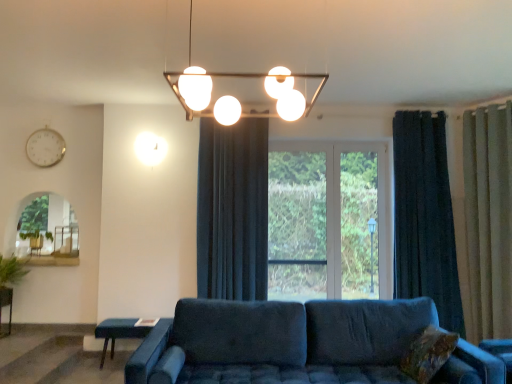
At what (x,y) coordinates should I click in order to perform the action: click on metallic pendant light at upper center. Please return your answer as a coordinate pair (x, y). Image resolution: width=512 pixels, height=384 pixels. Looking at the image, I should click on (234, 97).

At what (x,y) coordinates should I click in order to perform the action: click on beige fabric curtain at right, arranged as the 1th curtain when viewed from the right. Please return your answer as a coordinate pair (x, y). Looking at the image, I should click on (489, 218).

Where is `green leafy plant at left`? This screenshot has width=512, height=384. green leafy plant at left is located at coordinates (11, 271).

I want to click on white metallic clock at upper left, so click(x=45, y=147).

Identify the location of metallic pendant light at upper center. (234, 97).

Is brown textured pillow at lower right next to white metallic clock at upper left?

No, brown textured pillow at lower right is not next to white metallic clock at upper left.

What's the angular difference between brown textured pillow at lower right and white metallic clock at upper left's facing directions?

88.8 degrees.

Does brown textured pillow at lower right contain white metallic clock at upper left?

No, white metallic clock at upper left is not inside brown textured pillow at lower right.

From the picture: Measure the distance from brown textured pillow at lower right to white metallic clock at upper left.

brown textured pillow at lower right and white metallic clock at upper left are 4.40 meters apart from each other.

Is brown textured pillow at lower right inside green leafy plant at left?

Definitely not — brown textured pillow at lower right is not inside green leafy plant at left.

Is green leafy plant at left placed right next to brown textured pillow at lower right?

green leafy plant at left is not next to brown textured pillow at lower right, and they're not touching.

From a real-world perspective, relative to brown textured pillow at lower right, is green leafy plant at left vertically above or below?

In terms of real-world spatial position, green leafy plant at left is above brown textured pillow at lower right.

Considering the relative sizes of green leafy plant at left and brown textured pillow at lower right in the image provided, is green leafy plant at left wider than brown textured pillow at lower right?

Yes, green leafy plant at left is wider than brown textured pillow at lower right.

Can you tell me how much white metallic clock at upper left and wooden table at left, the 1th table in the left-to-right sequence, differ in facing direction?

The facing directions of white metallic clock at upper left and wooden table at left, the 1th table in the left-to-right sequence, are 2.54 degrees apart.

Is white metallic clock at upper left oriented towards wooden table at left, the 1th table in the left-to-right sequence?

No, white metallic clock at upper left is not facing towards wooden table at left, the 1th table in the left-to-right sequence.

Between white metallic clock at upper left and wooden table at left, the 1th table in the left-to-right sequence, which one has more height?

white metallic clock at upper left.

Is beige fabric curtain at right, the third curtain when ordered from left to right, looking in the opposite direction of brown textured pillow at lower right?

No, beige fabric curtain at right, the third curtain when ordered from left to right, is not facing the opposite direction of brown textured pillow at lower right.

Is the depth of beige fabric curtain at right, arranged as the 1th curtain when viewed from the right, greater than that of brown textured pillow at lower right?

Yes, beige fabric curtain at right, arranged as the 1th curtain when viewed from the right, is further from the camera.

How many degrees apart are the facing directions of beige fabric curtain at right, the third curtain when ordered from left to right, and brown textured pillow at lower right?

30 degrees.

Would you say brown textured pillow at lower right is part of beige fabric curtain at right, arranged as the 1th curtain when viewed from the right,'s contents?

No, brown textured pillow at lower right is located outside of beige fabric curtain at right, arranged as the 1th curtain when viewed from the right.

What's the angular difference between velvet blue couch at center and green leafy plant at left's facing directions?

The facing directions of velvet blue couch at center and green leafy plant at left are 3.76 degrees apart.

Is point (212, 366) closer or farther from the camera than point (12, 264)?

Clearly, point (212, 366) is closer to the camera than point (12, 264).

The image size is (512, 384). What are the coordinates of `plant that appears behind the velvet blue couch at center` in the screenshot? It's located at (11, 271).

Is velvet blue couch at center beside green leafy plant at left?

velvet blue couch at center and green leafy plant at left are not in contact.

Is blue fabric table at lower left, the 1th table positioned from the right, next to wooden table at left, which is counted as the second table, starting from the right?

No.

Which is more distant, (x=153, y=321) or (x=7, y=299)?

Positioned behind is point (x=7, y=299).

From a real-world perspective, which object rests below the other?

blue fabric table at lower left, the 2th table when ordered from left to right, from a real-world perspective.

Which is more to the right, blue fabric table at lower left, the 1th table positioned from the right, or wooden table at left, the 1th table in the left-to-right sequence?

From the viewer's perspective, blue fabric table at lower left, the 1th table positioned from the right, appears more on the right side.

Is white metallic clock at upper left taller than green leafy plant at left?

Yes, white metallic clock at upper left is taller than green leafy plant at left.

Looking at their sizes, would you say white metallic clock at upper left is wider or thinner than green leafy plant at left?

In the image, white metallic clock at upper left appears to be more narrow than green leafy plant at left.

Is point (46, 144) less distant than point (18, 276)?

No.

How many degrees apart are the facing directions of white metallic clock at upper left and green leafy plant at left?

2.54 degrees separate the facing orientations of white metallic clock at upper left and green leafy plant at left.

You are a GUI agent. You are given a task and a screenshot of the screen. Output one action in this format:
    pyautogui.click(x=<x>, y=<y>)
    Task: Click on the clock behind the brown textured pillow at lower right
    The height and width of the screenshot is (384, 512).
    Given the screenshot: What is the action you would take?
    pyautogui.click(x=45, y=147)

The width and height of the screenshot is (512, 384). What are the coordinates of `pillow in front of the green leafy plant at left` in the screenshot? It's located at (428, 354).

Considering their positions, is green leafy plant at left positioned closer to wooden table at left, the 1th table in the left-to-right sequence, than white metallic clock at upper left?

The object closer to wooden table at left, the 1th table in the left-to-right sequence, is green leafy plant at left.

From the image, which object appears to be nearer to wooden table at left, which is counted as the second table, starting from the right, brown textured pillow at lower right or blue fabric table at lower left, the 1th table positioned from the right?

blue fabric table at lower left, the 1th table positioned from the right, lies closer to wooden table at left, which is counted as the second table, starting from the right, than the other object.

Estimate the real-world distances between objects in this image. Which object is further from white metallic clock at upper left, green leafy plant at left or velvet blue couch at center?

velvet blue couch at center is further to white metallic clock at upper left.

Estimate the real-world distances between objects in this image. Which object is further from green leafy plant at left, beige fabric curtain at right, arranged as the 1th curtain when viewed from the right, or wooden table at left, which is counted as the second table, starting from the right?

beige fabric curtain at right, arranged as the 1th curtain when viewed from the right.

From the image, which object appears to be nearer to blue fabric table at lower left, the 2th table when ordered from left to right, white metallic clock at upper left or green leafy plant at left?

green leafy plant at left is positioned closer to the anchor blue fabric table at lower left, the 2th table when ordered from left to right.

Estimate the real-world distances between objects in this image. Which object is further from dark blue velvet curtain at right, which is counted as the 2th curtain, starting from the left, white metallic clock at upper left or wooden table at left, the 1th table in the left-to-right sequence?

Based on the image, wooden table at left, the 1th table in the left-to-right sequence, appears to be further to dark blue velvet curtain at right, which is counted as the 2th curtain, starting from the left.

Considering their positions, is velvet blue couch at center positioned closer to metallic pendant light at upper center than green leafy plant at left?

velvet blue couch at center is positioned closer to the anchor metallic pendant light at upper center.

Considering their positions, is dark blue velvet curtain at right, which is counted as the 2th curtain, starting from the left, positioned further to green leafy plant at left than wooden table at left, the 1th table in the left-to-right sequence?

The object further to green leafy plant at left is dark blue velvet curtain at right, which is counted as the 2th curtain, starting from the left.

Where is `lamp between wooden table at left, which is counted as the second table, starting from the right, and brown textured pillow at lower right`? This screenshot has width=512, height=384. lamp between wooden table at left, which is counted as the second table, starting from the right, and brown textured pillow at lower right is located at coordinates pos(234,97).

Where is `plant between wooden table at left, which is counted as the second table, starting from the right, and beige fabric curtain at right, the third curtain when ordered from left to right, from left to right`? The width and height of the screenshot is (512, 384). plant between wooden table at left, which is counted as the second table, starting from the right, and beige fabric curtain at right, the third curtain when ordered from left to right, from left to right is located at coordinates (11, 271).

Find the location of `table between white metallic clock at upper left and dark blue velvet curtain at center, which appears as the 3th curtain when viewed from the right, in the horizontal direction`. table between white metallic clock at upper left and dark blue velvet curtain at center, which appears as the 3th curtain when viewed from the right, in the horizontal direction is located at coordinates (121, 331).

The width and height of the screenshot is (512, 384). Identify the location of studio couch between green leafy plant at left and beige fabric curtain at right, arranged as the 1th curtain when viewed from the right, from left to right. (281, 342).